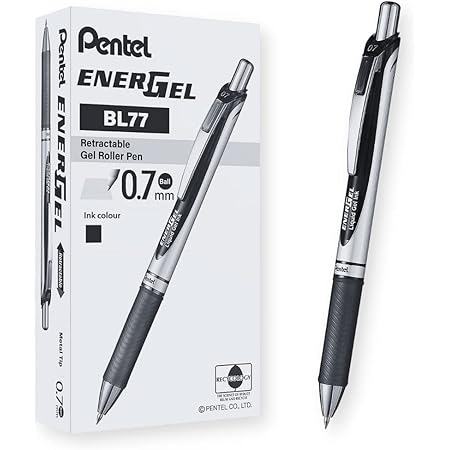
Locate an element on the screen. pen is located at coordinates (45, 229), (155, 266), (351, 314).